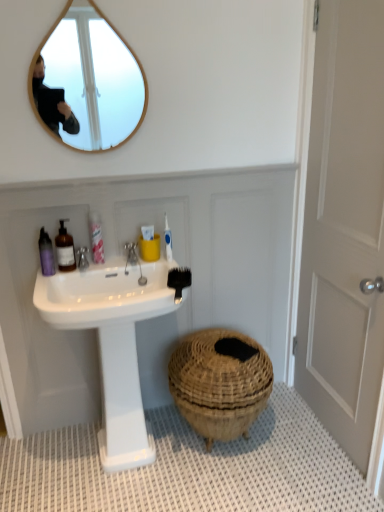
I want to click on free point in front of white matte door at right, so click(312, 478).